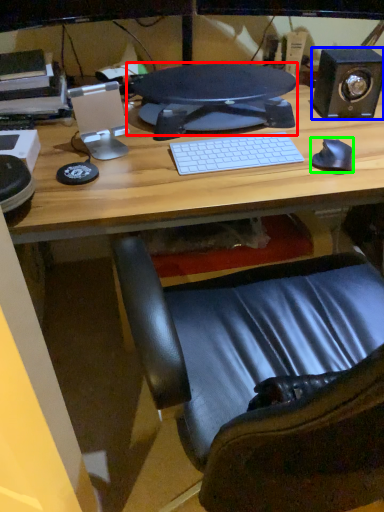
Question: Which object is positioned farthest from computer monitor (highlighted by a red box)? Select from speaker (highlighted by a blue box) and mouse (highlighted by a green box).

Choices:
 (A) speaker
 (B) mouse

Answer: (B)